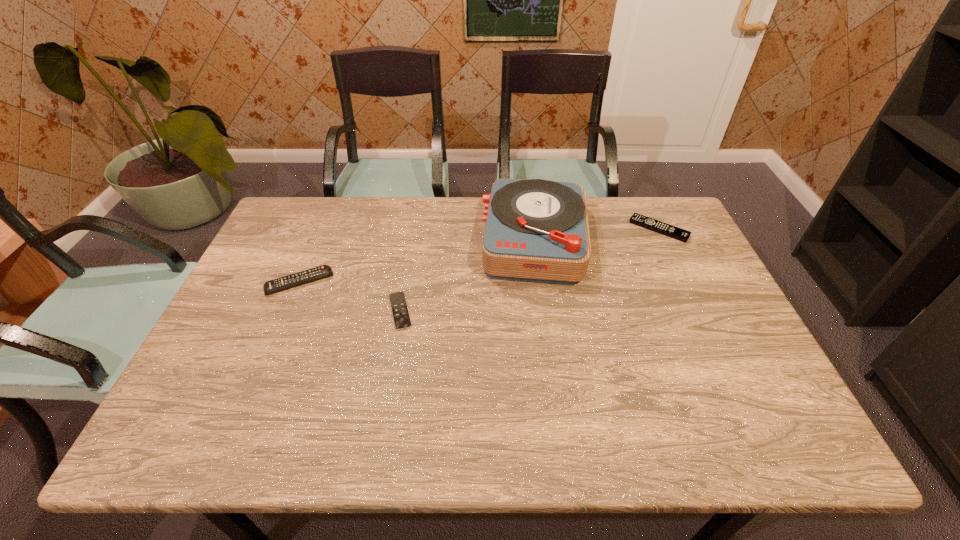
Image resolution: width=960 pixels, height=540 pixels. I want to click on vacant space that's between the shortest object and the leftmost object, so click(x=349, y=296).

Locate an element on the screen. Image resolution: width=960 pixels, height=540 pixels. the second closest object to the second shortest object is located at coordinates (401, 317).

Where is `object that is the second closest to the third object from left to right`? The image size is (960, 540). object that is the second closest to the third object from left to right is located at coordinates (401, 317).

Select which remote control appears as the second closest to the farthest remote control. Please provide its 2D coordinates. Your answer should be formatted as a tuple, i.e. [(x, y)], where the tuple contains the x and y coordinates of a point satisfying the conditions above.

[(289, 281)]

The width and height of the screenshot is (960, 540). I want to click on remote control that is the closest to the second object from left to right, so click(x=289, y=281).

At what (x,y) coordinates should I click in order to perform the action: click on vacant space that satisfies the following two spatial constraints: 1. on the back side of the third object from left to right; 2. on the right side of the second remote control from left to right. Please return your answer as a coordinate pair (x, y). Looking at the image, I should click on (413, 240).

Where is `vacant area that satisfies the following two spatial constraints: 1. on the back side of the second object from left to right; 2. on the right side of the record player`? The width and height of the screenshot is (960, 540). vacant area that satisfies the following two spatial constraints: 1. on the back side of the second object from left to right; 2. on the right side of the record player is located at coordinates (413, 240).